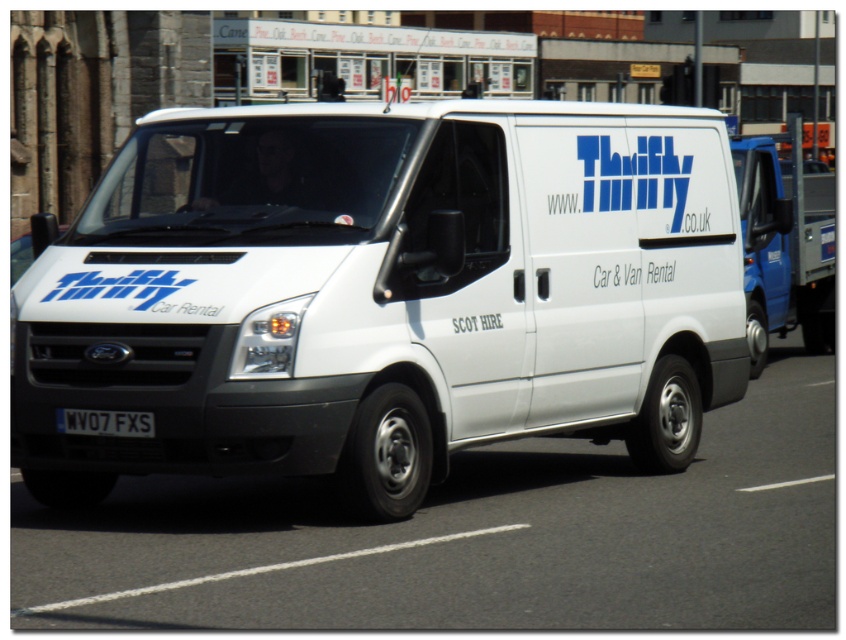
Between white matte van at center and black plastic license plate at center, which one has more height?

With more height is white matte van at center.

At what (x,y) coordinates should I click in order to perform the action: click on white matte van at center. Please return your answer as a coordinate pair (x, y). The image size is (846, 640). Looking at the image, I should click on (382, 292).

Identify the location of white matte van at center. This screenshot has height=640, width=846. (382, 292).

Locate an element on the screen. This screenshot has height=640, width=846. white matte van at center is located at coordinates (382, 292).